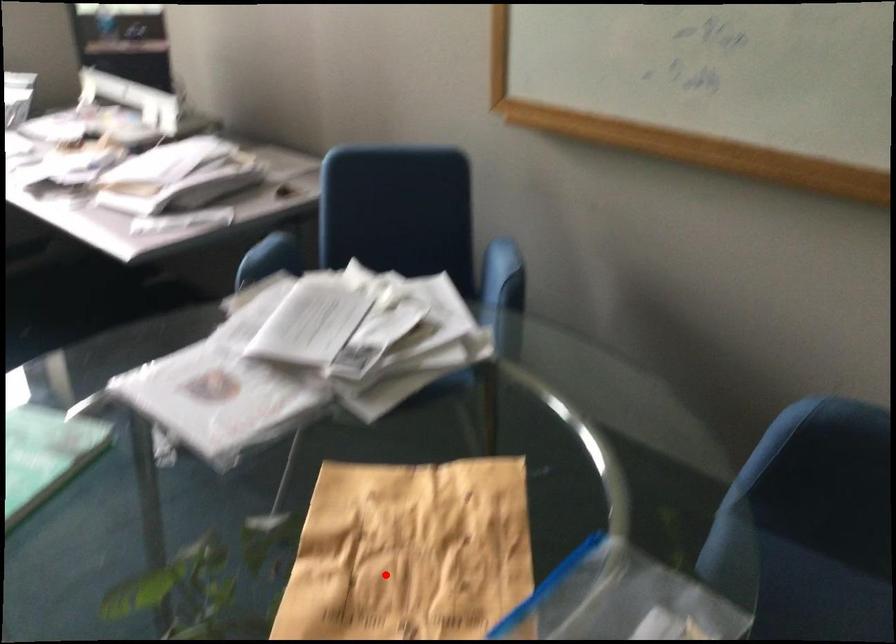
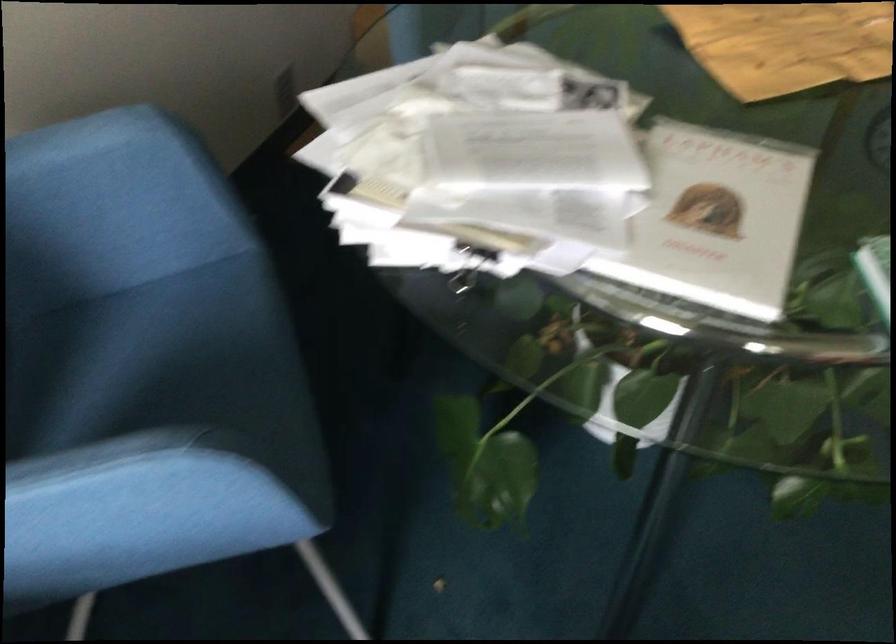
Question: I am providing you with two images of the same scene from different viewpoints. Given a red point in image1, look at the same physical point in image2. Is it:

Choices:
 (A) Closer to the viewpoint
 (B) Farther from the viewpoint

Answer: (B)